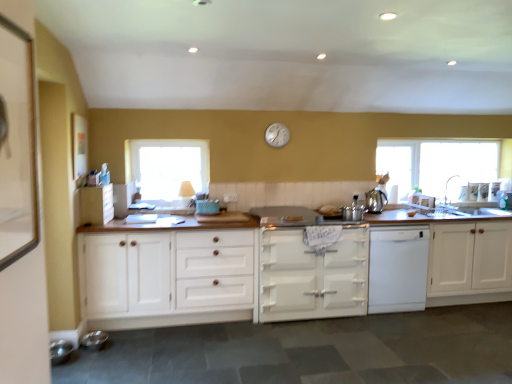
Identify the location of transparent glass window at right, placed as the first window when sorted from right to left. The image size is (512, 384). (437, 164).

How much space does transparent glass window at right, the second window in the left-to-right sequence, occupy horizontally?

The width of transparent glass window at right, the second window in the left-to-right sequence, is 2.49 inches.

At what (x,y) coordinates should I click in order to perform the action: click on white enamel gas stove at center. Please return your answer as a coordinate pair (x, y). This screenshot has height=384, width=512. Looking at the image, I should click on (293, 216).

Locate an element on the screen. transparent glass window at center, marked as the first window in a left-to-right arrangement is located at coordinates (168, 167).

This screenshot has width=512, height=384. Describe the element at coordinates (60, 351) in the screenshot. I see `metallic stainless steel bowls at lower left, positioned as the 3th appliance in top-to-bottom order` at that location.

Where is `white wood cabinet at center, which is counted as the 2th cabinetry, starting from the left`? This screenshot has width=512, height=384. white wood cabinet at center, which is counted as the 2th cabinetry, starting from the left is located at coordinates (168, 278).

I want to click on transparent glass window at right, the second window in the left-to-right sequence, so click(x=437, y=164).

From the image's perspective, is white wood cabinet at left, acting as the 1th cabinetry starting from the left, over metallic stainless steel bowls at lower left, the 1th appliance positioned from the front?

Yes, from the image's perspective, white wood cabinet at left, acting as the 1th cabinetry starting from the left, is above metallic stainless steel bowls at lower left, the 1th appliance positioned from the front.

From a real-world perspective, is white wood cabinet at left, placed as the fourth cabinetry when sorted from right to left, above or below metallic stainless steel bowls at lower left, the first appliance in the left-to-right sequence?

Clearly, from a real-world perspective, white wood cabinet at left, placed as the fourth cabinetry when sorted from right to left, is above metallic stainless steel bowls at lower left, the first appliance in the left-to-right sequence.

Considering the positions of objects white wood cabinet at left, acting as the 1th cabinetry starting from the left, and metallic stainless steel bowls at lower left, the 1th appliance positioned from the front, in the image provided, who is more to the right, white wood cabinet at left, acting as the 1th cabinetry starting from the left, or metallic stainless steel bowls at lower left, the 1th appliance positioned from the front,?

Positioned to the right is white wood cabinet at left, acting as the 1th cabinetry starting from the left.

Is white wood cabinet at left, acting as the 1th cabinetry starting from the left, closer to camera compared to metallic stainless steel bowls at lower left, the 3th appliance from the right?

No, white wood cabinet at left, acting as the 1th cabinetry starting from the left, is behind metallic stainless steel bowls at lower left, the 3th appliance from the right.

Which object is further away from the camera, white plastic clock at upper center or transparent glass window at center, the 2th window when ordered from back to front?

Positioned behind is white plastic clock at upper center.

Does white plastic clock at upper center turn towards transparent glass window at center, the 2th window when ordered from back to front?

No, white plastic clock at upper center is not facing towards transparent glass window at center, the 2th window when ordered from back to front.

Is white plastic clock at upper center located outside transparent glass window at center, the 2th window when ordered from back to front?

Yes.

Is white plastic clock at upper center far away from transparent glass window at center, the 2th window when ordered from back to front?

Yes, white plastic clock at upper center is far from transparent glass window at center, the 2th window when ordered from back to front.

How far apart are metallic stainless steel bowls at lower left, placed as the 1th appliance when sorted from bottom to top, and transparent glass window at center, the 1th window positioned from the front?

6.05 feet.

Is metallic stainless steel bowls at lower left, the 3th appliance from the right, facing away from transparent glass window at center, marked as the first window in a left-to-right arrangement?

metallic stainless steel bowls at lower left, the 3th appliance from the right, does not have its back to transparent glass window at center, marked as the first window in a left-to-right arrangement.

Who is more distant, metallic stainless steel bowls at lower left, the 3th appliance from the right, or transparent glass window at center, the 1th window positioned from the front?

transparent glass window at center, the 1th window positioned from the front, is further from the camera.

Considering the positions of points (66, 350) and (206, 180), is point (66, 350) farther from camera compared to point (206, 180)?

No, it is in front of (206, 180).

Is metallic silver pots at center, which is the first appliance in right-to-left order, inside or outside of transparent glass window at right, which appears as the first window when viewed from the back?

metallic silver pots at center, which is the first appliance in right-to-left order, exists outside the volume of transparent glass window at right, which appears as the first window when viewed from the back.

Considering the relative sizes of metallic silver pots at center, which is counted as the first appliance, starting from the top, and transparent glass window at right, which appears as the first window when viewed from the back, in the image provided, is metallic silver pots at center, which is counted as the first appliance, starting from the top, taller than transparent glass window at right, which appears as the first window when viewed from the back,?

Incorrect, the height of metallic silver pots at center, which is counted as the first appliance, starting from the top, is not larger of that of transparent glass window at right, which appears as the first window when viewed from the back.

Who is smaller, metallic silver pots at center, which ranks as the 3th appliance in left-to-right order, or transparent glass window at right, the second window in the left-to-right sequence?

With smaller size is metallic silver pots at center, which ranks as the 3th appliance in left-to-right order.

Does point (350, 213) come closer to viewer compared to point (488, 146)?

Yes.

Looking at this image, between metallic silver pots at center, which is the first appliance in right-to-left order, and transparent glass window at center, acting as the second window starting from the right, which one has more height?

transparent glass window at center, acting as the second window starting from the right, is taller.

Can you confirm if metallic silver pots at center, which ranks as the first appliance in back-to-front order, is thinner than transparent glass window at center, the 2th window when ordered from back to front?

Incorrect, the width of metallic silver pots at center, which ranks as the first appliance in back-to-front order, is not less than that of transparent glass window at center, the 2th window when ordered from back to front.

Is metallic silver pots at center, placed as the third appliance when sorted from bottom to top, spatially inside transparent glass window at center, marked as the first window in a left-to-right arrangement, or outside of it?

metallic silver pots at center, placed as the third appliance when sorted from bottom to top, exists outside the volume of transparent glass window at center, marked as the first window in a left-to-right arrangement.

Is the depth of metallic silver pots at center, placed as the third appliance when sorted from bottom to top, less than that of transparent glass window at center, marked as the first window in a left-to-right arrangement?

That is True.

Is point (203, 322) farther from viewer compared to point (300, 210)?

That is False.

Which object is closer to the camera taking this photo, white wood cabinet at center, which is counted as the 2th cabinetry, starting from the left, or white enamel gas stove at center?

white wood cabinet at center, which is counted as the 2th cabinetry, starting from the left, is in front.

From the image's perspective, which is below, white wood cabinet at center, the third cabinetry when ordered from right to left, or white enamel gas stove at center?

From the image's view, white wood cabinet at center, the third cabinetry when ordered from right to left, is below.

In the scene shown: Is white wood cabinet at center, which is counted as the 2th cabinetry, starting from the left, not near white enamel gas stove at center?

No.

Is metallic silver bowl at lower left, marked as the second appliance in a back-to-front arrangement, positioned in front of metallic stainless steel bowls at lower left, the 1th appliance positioned from the front?

No.

Looking at this image, does metallic silver bowl at lower left, which is counted as the 2th appliance, starting from the top, appear on the left side of metallic stainless steel bowls at lower left, the 3th appliance from the right?

No.

Which of these two, metallic silver bowl at lower left, the second appliance positioned from the front, or metallic stainless steel bowls at lower left, placed as the 1th appliance when sorted from bottom to top, stands taller?

Standing taller between the two is metallic stainless steel bowls at lower left, placed as the 1th appliance when sorted from bottom to top.

The image size is (512, 384). I want to click on the 3rd appliance positioned below the white wood cabinet at left, placed as the fourth cabinetry when sorted from right to left (from the image's perspective), so click(60, 351).

Locate an element on the screen. This screenshot has width=512, height=384. clock that is above the transparent glass window at center, the 2th window when ordered from back to front (from a real-world perspective) is located at coordinates (277, 135).

Looking at the image, which one is located closer to metallic silver bowl at lower left, which is counted as the 2th appliance, starting from the top, transparent glass window at center, the 2th window when ordered from back to front, or white painted wood stove at center, which is the second cabinetry in right-to-left order?

Based on the image, transparent glass window at center, the 2th window when ordered from back to front, appears to be nearer to metallic silver bowl at lower left, which is counted as the 2th appliance, starting from the top.

Based on their spatial positions, is metallic stainless steel bowls at lower left, positioned as the 3th appliance in top-to-bottom order, or white matte dishwasher at center closer to metallic silver bowl at lower left, the second appliance positioned from the front?

metallic stainless steel bowls at lower left, positioned as the 3th appliance in top-to-bottom order, is closer to metallic silver bowl at lower left, the second appliance positioned from the front.

When comparing their distances from metallic stainless steel bowls at lower left, positioned as the 3th appliance in top-to-bottom order, does white matte dishwasher at center or white plastic clock at upper center seem further?

white matte dishwasher at center.

Looking at the image, which one is located closer to shiny metallic kettle at right, white wood cabinet at center, which is counted as the 2th cabinetry, starting from the left, or metallic silver pots at center, placed as the third appliance when sorted from bottom to top?

metallic silver pots at center, placed as the third appliance when sorted from bottom to top.

Considering their positions, is white painted wood stove at center, which is the third cabinetry from left to right, positioned further to white enamel gas stove at center than white wood cabinet at left, acting as the 1th cabinetry starting from the left?

white wood cabinet at left, acting as the 1th cabinetry starting from the left, lies further to white enamel gas stove at center than the other object.

Estimate the real-world distances between objects in this image. Which object is further from transparent glass window at right, the second window when ordered from front to back, white matte dishwasher at center or white wood cabinet at center, which is counted as the 2th cabinetry, starting from the left?

The object further to transparent glass window at right, the second window when ordered from front to back, is white wood cabinet at center, which is counted as the 2th cabinetry, starting from the left.

Considering their positions, is white plastic clock at upper center positioned further to white wood cabinet at right, which appears as the first cabinetry when viewed from the right, than white wood cabinet at left, acting as the 1th cabinetry starting from the left?

Based on the image, white wood cabinet at left, acting as the 1th cabinetry starting from the left, appears to be further to white wood cabinet at right, which appears as the first cabinetry when viewed from the right.

When comparing their distances from transparent glass window at right, which appears as the first window when viewed from the back, does metallic silver bowl at lower left, the second appliance positioned from the front, or white wood cabinet at left, placed as the fourth cabinetry when sorted from right to left, seem closer?

white wood cabinet at left, placed as the fourth cabinetry when sorted from right to left, lies closer to transparent glass window at right, which appears as the first window when viewed from the back, than the other object.

Where is `appliance between white wood cabinet at center, which is counted as the 2th cabinetry, starting from the left, and white matte dishwasher at center`? appliance between white wood cabinet at center, which is counted as the 2th cabinetry, starting from the left, and white matte dishwasher at center is located at coordinates (353, 211).

The height and width of the screenshot is (384, 512). In order to click on gas stove situated between transparent glass window at center, acting as the second window starting from the right, and white wood cabinet at right, which is counted as the fourth cabinetry, starting from the left, from left to right in this screenshot , I will do `click(293, 216)`.

Find the location of a particular element. Image resolution: width=512 pixels, height=384 pixels. clock between metallic silver bowl at lower left, the second appliance from the right, and shiny metallic kettle at right from left to right is located at coordinates (277, 135).

Where is `gas stove between white plastic clock at upper center and shiny metallic kettle at right from left to right`? This screenshot has width=512, height=384. gas stove between white plastic clock at upper center and shiny metallic kettle at right from left to right is located at coordinates (293, 216).